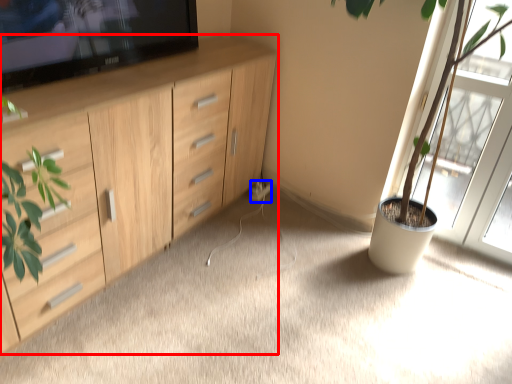
Question: Which of the following is the farthest to the observer, cabinetry (highlighted by a red box) or electric outlet (highlighted by a blue box)?

Choices:
 (A) cabinetry
 (B) electric outlet

Answer: (B)